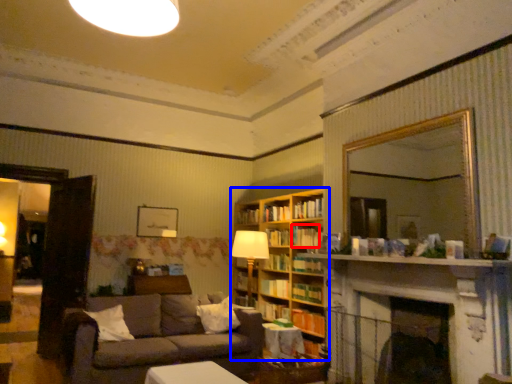
Question: Which object appears closest to the camera in this image, book (highlighted by a red box) or bookcase (highlighted by a blue box)?

Choices:
 (A) book
 (B) bookcase

Answer: (B)